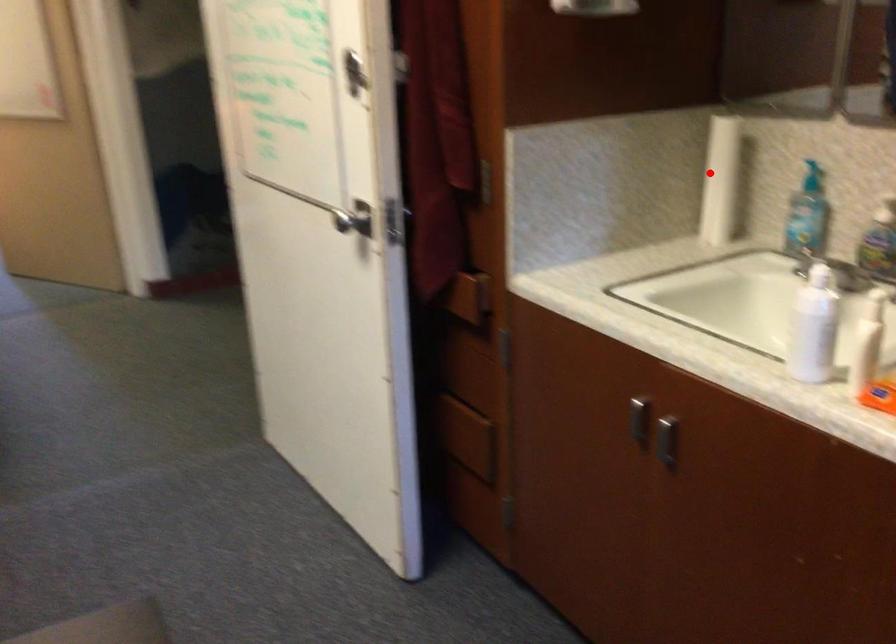
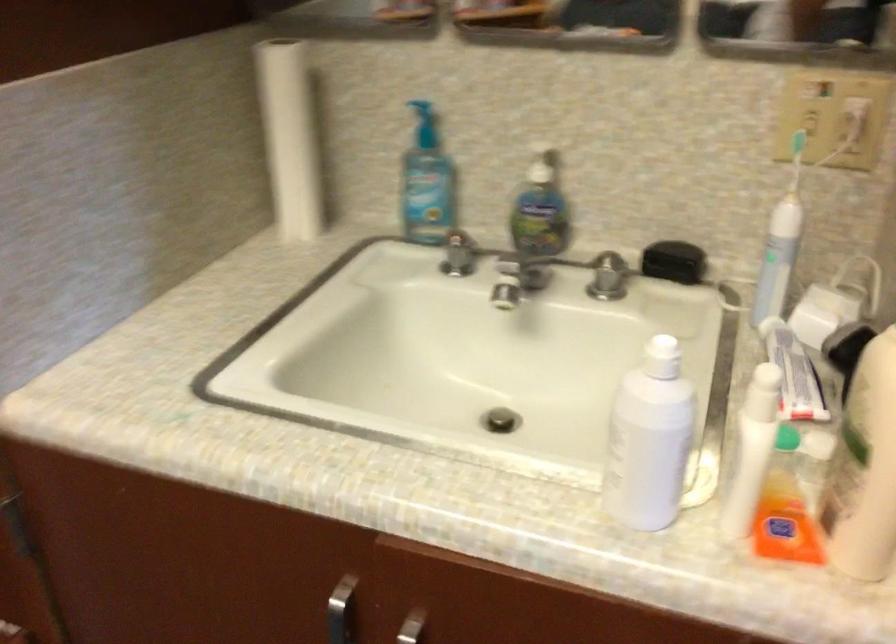
The point at the highlighted location is marked in the first image. Where is the corresponding point in the second image?

(289, 138)